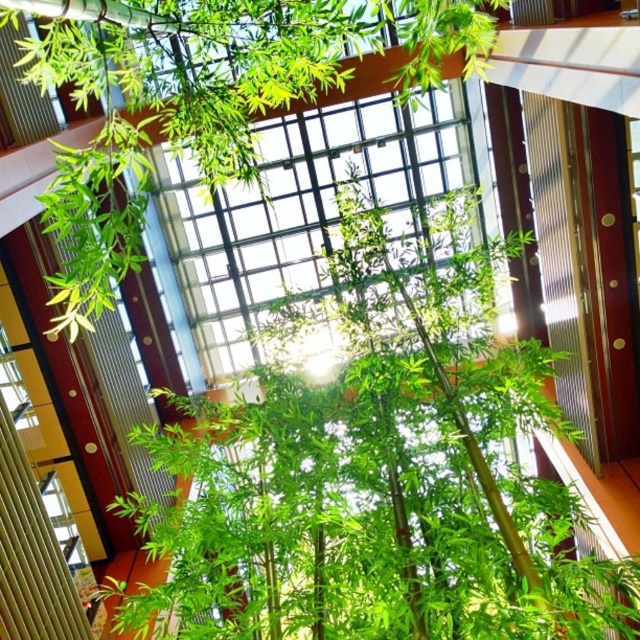
You are standing in the atrium and want to place a small potted plant exactly at the center of the green bamboo at center. Where should you place it?

The green bamboo at center is located at point (376, 468), so you should place the potted plant at those coordinates.

You are an interior designer planning to add more plants to the atrium. Given the current arrangement, which object between the green bamboo at center and the clear glass window at upper left takes up more visual space in the scene?

The clear glass window at upper left takes up more visual space than the green bamboo at center because the green bamboo at center occupies less space than clear glass window at upper left.